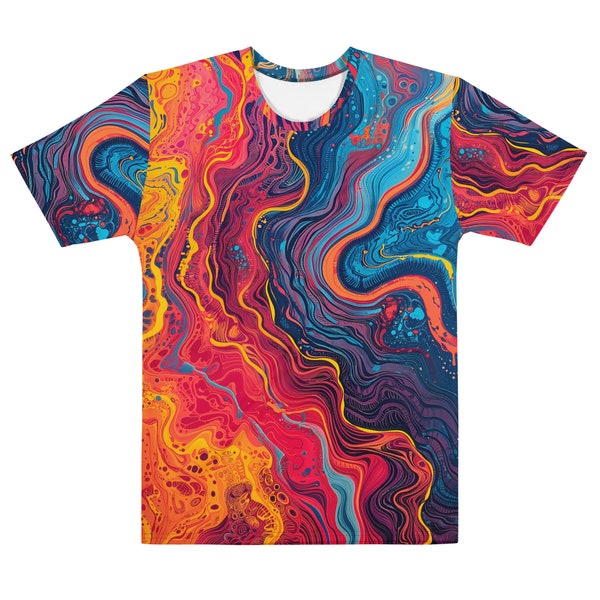
The image size is (600, 600). What are the coordinates of `white interior` in the screenshot? It's located at (298, 101).